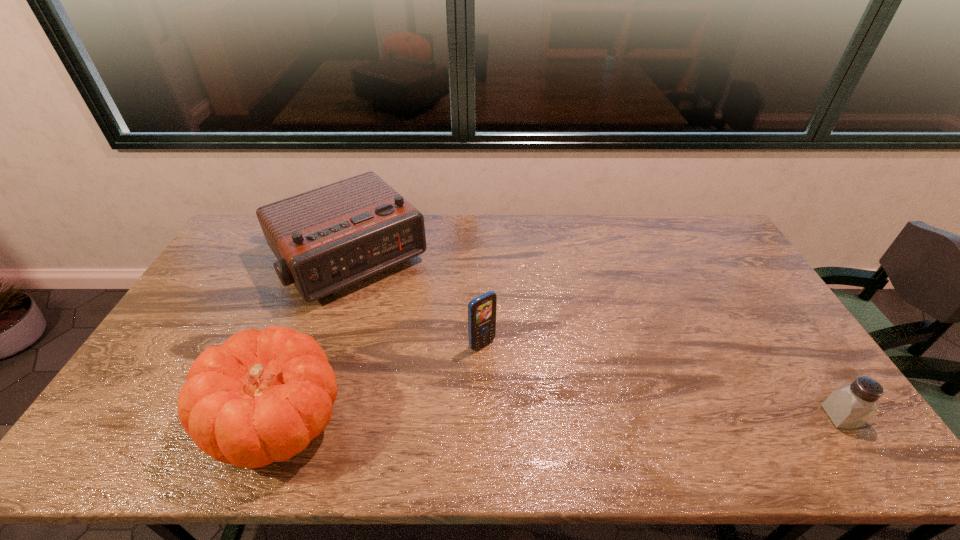
In the image, there is a desktop. Identify the location of vacant region at the near edge. This screenshot has height=540, width=960. (337, 416).

In the image, there is a desktop. What are the coordinates of `vacant area at the left edge` in the screenshot? It's located at (180, 323).

Where is `vacant space at the right edge of the desktop`? Image resolution: width=960 pixels, height=540 pixels. vacant space at the right edge of the desktop is located at coordinates (715, 268).

In the image, there is a desktop. Identify the location of vacant space at the far left corner. (238, 233).

Locate an element on the screen. This screenshot has width=960, height=540. free region at the near left corner of the desktop is located at coordinates (128, 418).

This screenshot has width=960, height=540. Find the location of `free point between the shortest object and the farthest object`. free point between the shortest object and the farthest object is located at coordinates (595, 338).

The height and width of the screenshot is (540, 960). I want to click on empty space that is in between the third nearest object and the farthest object, so click(417, 302).

Where is `empty location between the farthest object and the cellular telephone`? This screenshot has height=540, width=960. empty location between the farthest object and the cellular telephone is located at coordinates (417, 302).

Locate an element on the screen. free space between the pumpkin and the saltshaker is located at coordinates (560, 418).

You are a GUI agent. You are given a task and a screenshot of the screen. Output one action in this format:
    pyautogui.click(x=<x>, y=<y>)
    Task: Click on the vacant space that is in between the radio receiver and the cellular telephone
    The width and height of the screenshot is (960, 540).
    Given the screenshot: What is the action you would take?
    [417, 302]